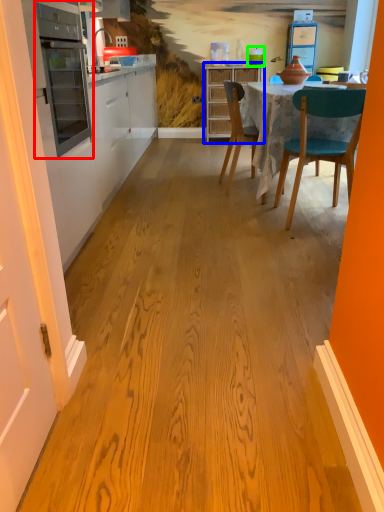
Question: Which is farther away from appliance (highlighted by a red box)? cabinetry (highlighted by a blue box) or teal (highlighted by a green box)?

Choices:
 (A) cabinetry
 (B) teal

Answer: (B)